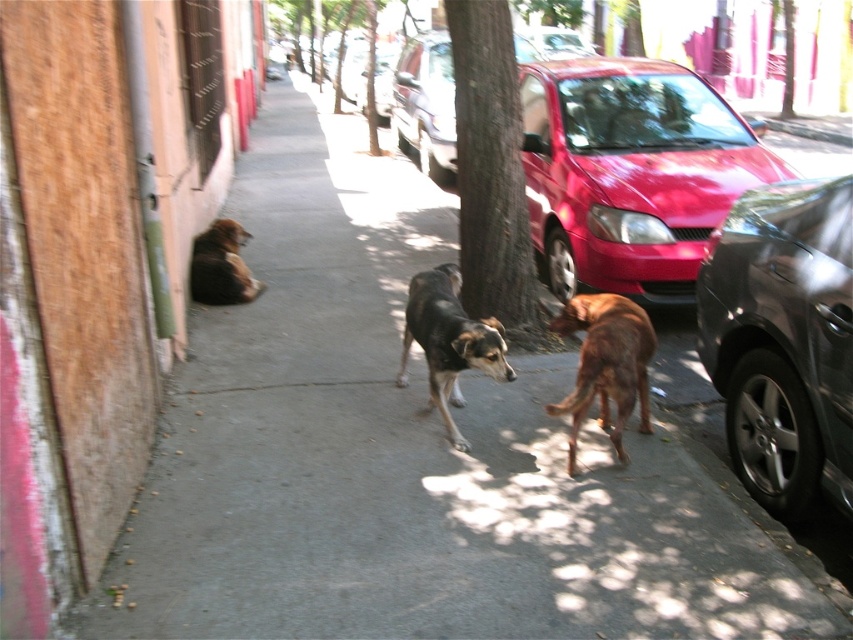
Question: Which of the following is the farthest from the observer?

Choices:
 (A) shiny metallic car at right
 (B) brown fur dog at lower left

Answer: (B)

Question: Can you confirm if brown furry dog at center is positioned below black and tan fur dog at center?

Choices:
 (A) yes
 (B) no

Answer: (A)

Question: Is shiny red car at right to the right of shiny red car at center from the viewer's perspective?

Choices:
 (A) no
 (B) yes

Answer: (B)

Question: Does shiny metallic car at right have a greater width compared to brown fur dog at lower left?

Choices:
 (A) yes
 (B) no

Answer: (B)

Question: Which object is positioned closest to the green textured tree at center?

Choices:
 (A) shiny red car at center
 (B) black and tan fur dog at center
 (C) shiny red car at right

Answer: (B)

Question: Among these objects, which one is nearest to the camera?

Choices:
 (A) brown furry dog at center
 (B) shiny red car at center
 (C) green textured tree at center

Answer: (A)